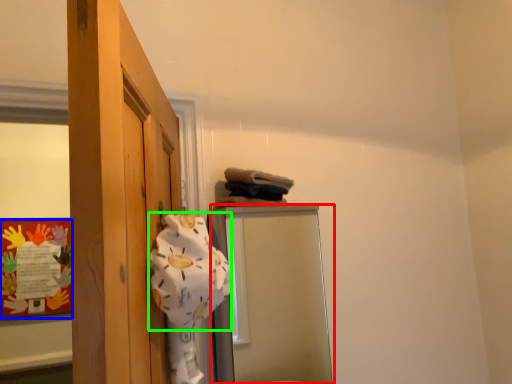
Question: Estimate the real-world distances between objects in this image. Which object is closer to mirror (highlighted by a red box), bulletin board (highlighted by a blue box) or bath towel (highlighted by a green box)?

Choices:
 (A) bulletin board
 (B) bath towel

Answer: (A)